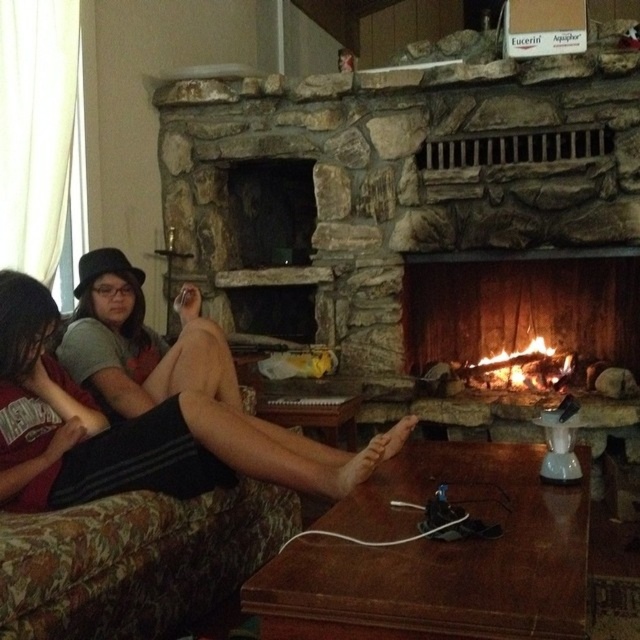
Question: Is matte black shorts at center to the left of charcoal wood fire at center from the viewer's perspective?

Choices:
 (A) no
 (B) yes

Answer: (B)

Question: Which object is the farthest from the matte black shorts at center?

Choices:
 (A) wooden logs burning at center
 (B) matte black hat at upper left

Answer: (A)

Question: Is matte black shorts at center closer to camera compared to matte black hat at upper left?

Choices:
 (A) yes
 (B) no

Answer: (A)

Question: Where is matte black shorts at center located in relation to charcoal wood fire at center in the image?

Choices:
 (A) below
 (B) above

Answer: (B)

Question: Which of the following is the closest to the observer?

Choices:
 (A) charcoal wood fire at center
 (B) wooden logs burning at center
 (C) matte black hat at upper left
 (D) matte black shorts at center

Answer: (D)

Question: Among these objects, which one is nearest to the camera?

Choices:
 (A) matte black shorts at center
 (B) charcoal wood fire at center

Answer: (A)